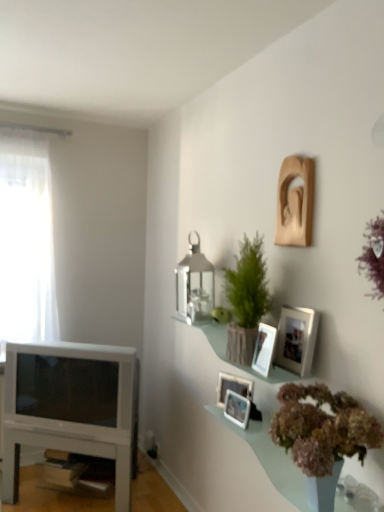
Question: Is wooden picture frame at upper right, placed as the 3th picture frame when sorted from top to bottom, to the left of white glossy table at lower left from the viewer's perspective?

Choices:
 (A) yes
 (B) no

Answer: (B)

Question: Is wooden picture frame at upper right, which is the 3th picture frame from bottom to top, oriented towards white glossy table at lower left?

Choices:
 (A) yes
 (B) no

Answer: (B)

Question: Can you confirm if wooden picture frame at upper right, which is the 3th picture frame from bottom to top, is positioned to the right of white glossy table at lower left?

Choices:
 (A) no
 (B) yes

Answer: (B)

Question: Does wooden picture frame at upper right, which is the 3th picture frame from bottom to top, have a lesser width compared to white glossy table at lower left?

Choices:
 (A) yes
 (B) no

Answer: (A)

Question: Is wooden picture frame at upper right, which is the 3th picture frame from bottom to top, outside white glossy table at lower left?

Choices:
 (A) yes
 (B) no

Answer: (A)

Question: Are wooden picture frame at upper right, placed as the 3th picture frame when sorted from top to bottom, and white glossy table at lower left making contact?

Choices:
 (A) yes
 (B) no

Answer: (B)

Question: Is white glossy table at lower left bigger than wooden photo frame at upper right, arranged as the fourth picture frame when ordered from the bottom?

Choices:
 (A) yes
 (B) no

Answer: (A)

Question: From the image's perspective, does white glossy table at lower left appear higher than wooden photo frame at upper right, arranged as the fourth picture frame when ordered from the bottom?

Choices:
 (A) no
 (B) yes

Answer: (A)

Question: Is white glossy table at lower left shorter than wooden photo frame at upper right, arranged as the fourth picture frame when ordered from the bottom?

Choices:
 (A) yes
 (B) no

Answer: (B)

Question: Does white glossy table at lower left have a lesser width compared to wooden photo frame at upper right, the second picture frame in the top-to-bottom sequence?

Choices:
 (A) no
 (B) yes

Answer: (A)

Question: Is white glossy table at lower left placed right next to wooden photo frame at upper right, arranged as the fourth picture frame when ordered from the bottom?

Choices:
 (A) yes
 (B) no

Answer: (B)

Question: Can you confirm if white glossy table at lower left is smaller than wooden photo frame at upper right, the second picture frame in the top-to-bottom sequence?

Choices:
 (A) yes
 (B) no

Answer: (B)

Question: Does matte silver picture frame at center, which ranks as the 4th picture frame in top-to-bottom order, have a smaller size compared to matte silver picture frame at center, positioned as the 5th picture frame in top-to-bottom order?

Choices:
 (A) no
 (B) yes

Answer: (A)